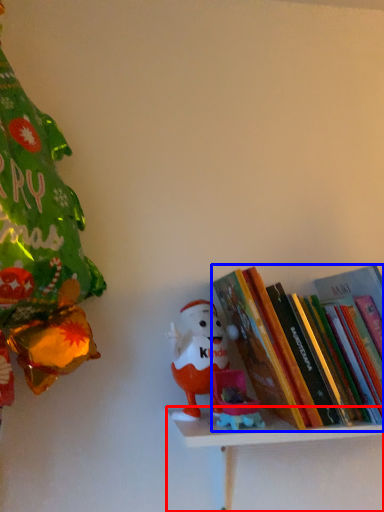
Question: Which point is closer to the camera, shelf (highlighted by a red box) or book (highlighted by a blue box)?

Choices:
 (A) shelf
 (B) book

Answer: (A)